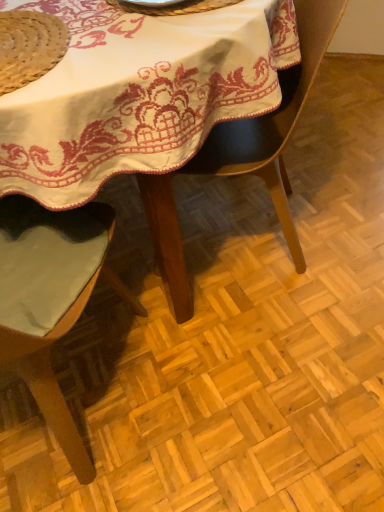
Locate an element on the screen. This screenshot has width=384, height=512. vacant area that lies between black leather chair at center, the first chair viewed from the right, and green fabric chair at left, which is the second chair in right-to-left order is located at coordinates (190, 320).